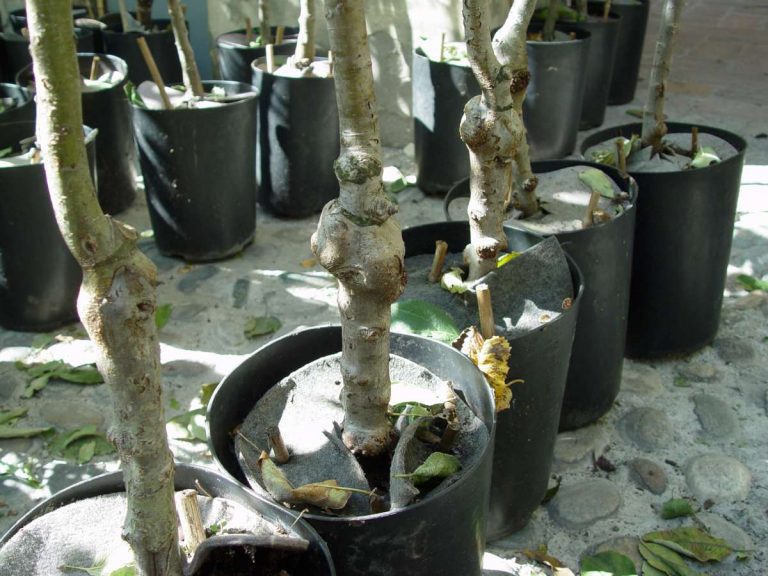
Where is `wall`? The height and width of the screenshot is (576, 768). wall is located at coordinates (414, 60).